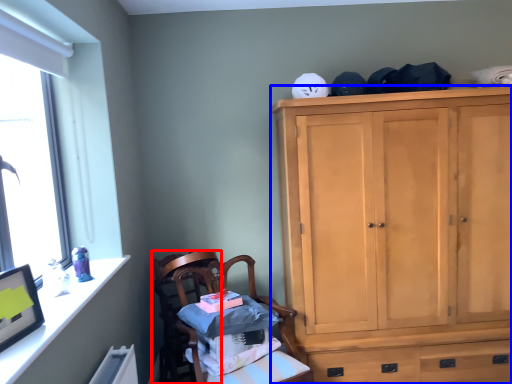
Question: Which point is further to the camera, chair (highlighted by a red box) or cabinetry (highlighted by a blue box)?

Choices:
 (A) chair
 (B) cabinetry

Answer: (A)